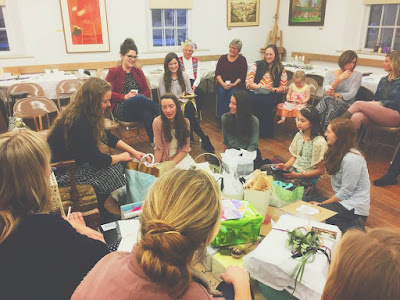
This screenshot has height=300, width=400. I want to click on table, so click(x=299, y=212).